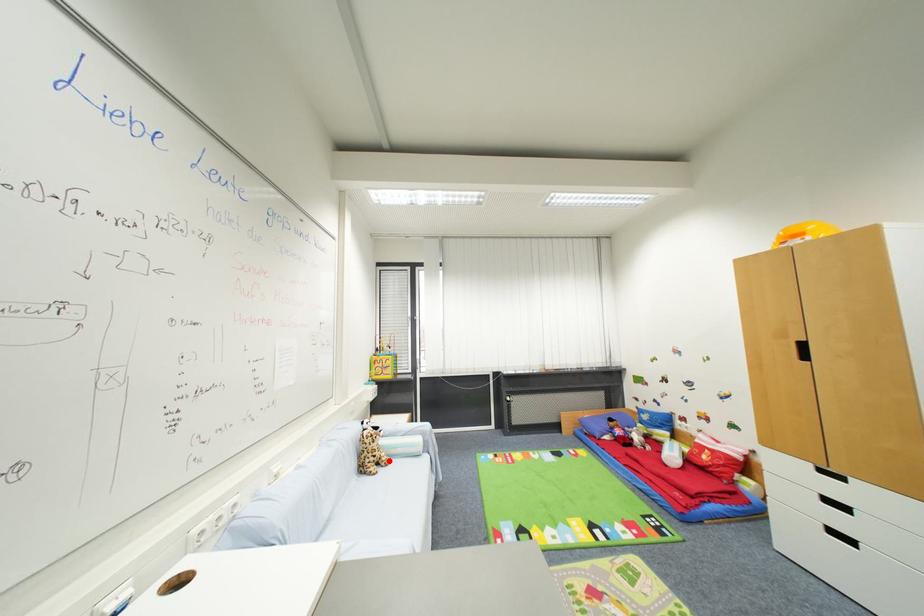
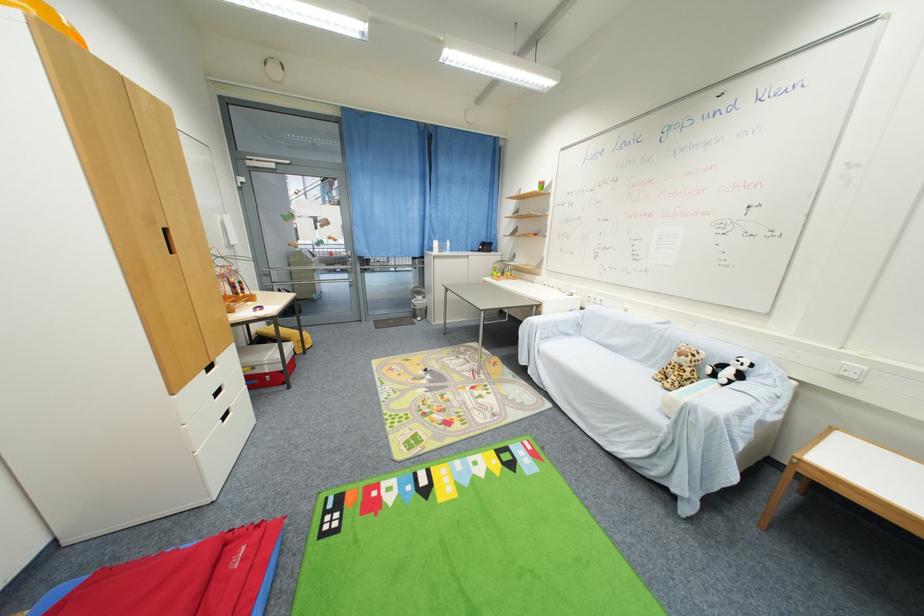
Where in the second image is the point corresponding to the highlighted location from the first image?

(675, 382)